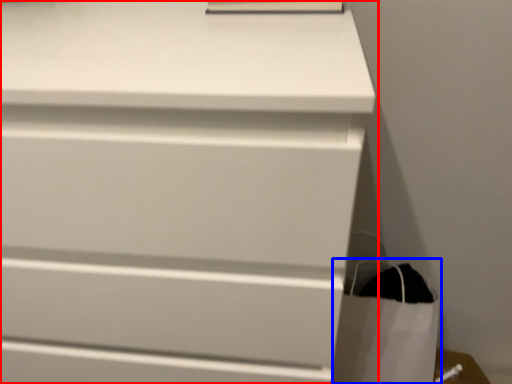
Question: Which point is further to the camera, chest of drawers (highlighted by a red box) or shopping bag (highlighted by a blue box)?

Choices:
 (A) chest of drawers
 (B) shopping bag

Answer: (B)